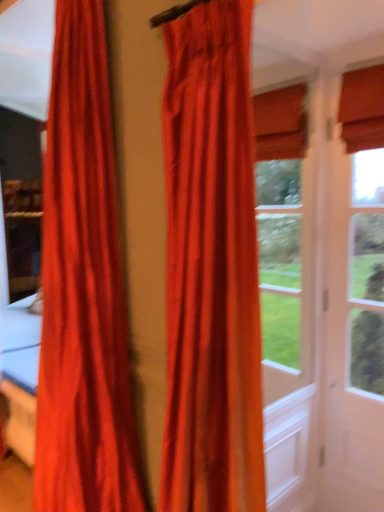
Question: Considering the relative positions of matte white screen door at right and satin-like red curtain at center, the first curtain positioned from the right, in the image provided, is matte white screen door at right to the right of satin-like red curtain at center, the first curtain positioned from the right, from the viewer's perspective?

Choices:
 (A) no
 (B) yes

Answer: (B)

Question: From the image's perspective, would you say matte white screen door at right is shown under satin-like red curtain at center, which appears as the 2th curtain when viewed from the left?

Choices:
 (A) yes
 (B) no

Answer: (A)

Question: Is matte white screen door at right facing towards satin-like red curtain at center, which appears as the 2th curtain when viewed from the left?

Choices:
 (A) yes
 (B) no

Answer: (A)

Question: Is satin-like red curtain at center, the first curtain positioned from the right, a part of matte white screen door at right?

Choices:
 (A) yes
 (B) no

Answer: (B)

Question: Is matte white screen door at right looking in the opposite direction of satin-like red curtain at center, the first curtain positioned from the right?

Choices:
 (A) yes
 (B) no

Answer: (B)

Question: Considering the relative sizes of matte white screen door at right and satin-like red curtain at center, which appears as the 2th curtain when viewed from the left, in the image provided, is matte white screen door at right taller than satin-like red curtain at center, which appears as the 2th curtain when viewed from the left,?

Choices:
 (A) yes
 (B) no

Answer: (A)

Question: From a real-world perspective, does satin orange curtain at left, marked as the first curtain in a left-to-right arrangement, sit lower than matte white screen door at right?

Choices:
 (A) no
 (B) yes

Answer: (A)

Question: Is the depth of satin orange curtain at left, marked as the first curtain in a left-to-right arrangement, greater than that of matte white screen door at right?

Choices:
 (A) no
 (B) yes

Answer: (A)

Question: From the image's perspective, is satin orange curtain at left, which is the 2th curtain in right-to-left order, located above matte white screen door at right?

Choices:
 (A) yes
 (B) no

Answer: (A)

Question: Is matte white screen door at right located within satin orange curtain at left, which is the 2th curtain in right-to-left order?

Choices:
 (A) no
 (B) yes

Answer: (A)

Question: Is satin orange curtain at left, marked as the first curtain in a left-to-right arrangement, bigger than matte white screen door at right?

Choices:
 (A) yes
 (B) no

Answer: (A)

Question: Is satin orange curtain at left, which is the 2th curtain in right-to-left order, at the left side of matte white screen door at right?

Choices:
 (A) yes
 (B) no

Answer: (A)

Question: From the image's perspective, does satin-like red curtain at center, the first curtain positioned from the right, appear lower than satin orange curtain at left, marked as the first curtain in a left-to-right arrangement?

Choices:
 (A) no
 (B) yes

Answer: (B)